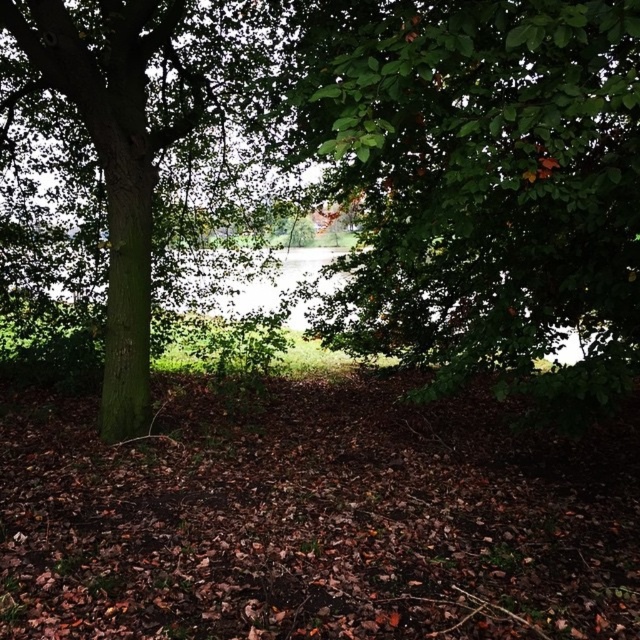
You are standing at the center of the scene looking towards the green leafy tree at center. Which direction should you move to get closer to the tree?

The green leafy tree at center is located at point (481, 182), so you should move towards the coordinates provided to get closer to the tree.

You are a hiker standing in the middle of the forest and you see the green leafy tree at center and the green rough bark tree at left. Which tree is closer to your left side?

The green rough bark tree at left is closer to your left side because it is positioned on the left side of the green leafy tree at center.

You are standing in a forest and want to walk towards the green leafy tree at center and the green rough bark tree at left. Which tree will you reach first?

You will reach the green leafy tree at center first because it is closer to you than the green rough bark tree at left.